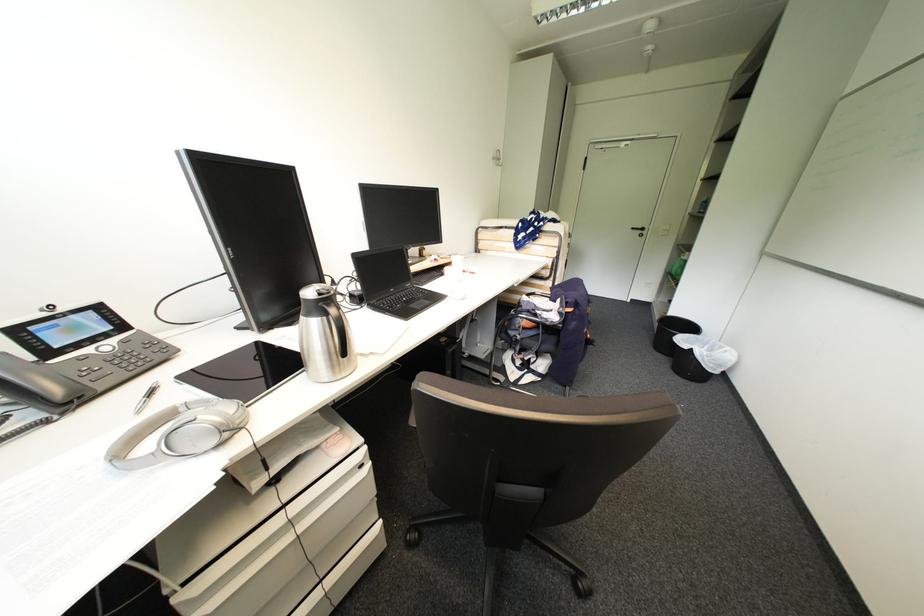
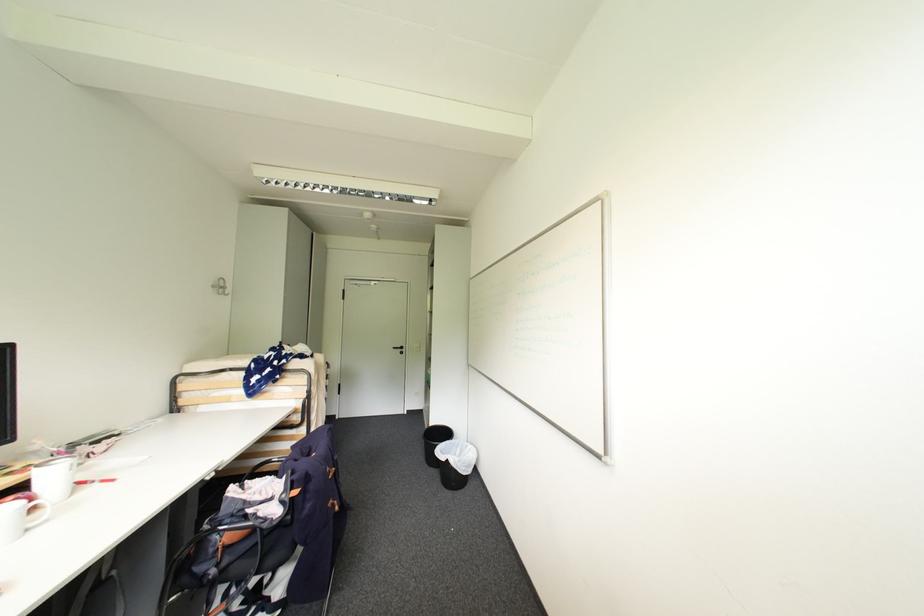
In the second image, find the point that corresponds to the point at 500,159 in the first image.

(220, 286)